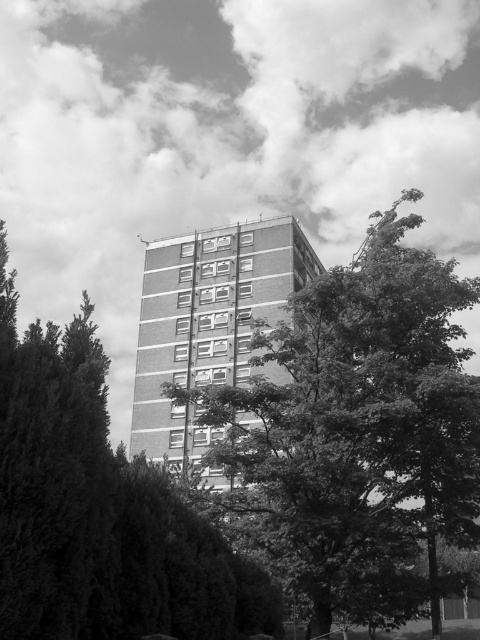
You are standing in front of the residential building and want to take a photo of the building without any trees blocking the view. Based on the coordinates provided, where should you move to ensure the dark green leafy tree at center is out of frame?

To avoid the dark green leafy tree at center located at coordinates point [357,429], you should move to a position where the camera frame does not include that coordinate. Moving to the left or right of the current position would shift the view away from the tree, ensuring it is no longer blocking the building.